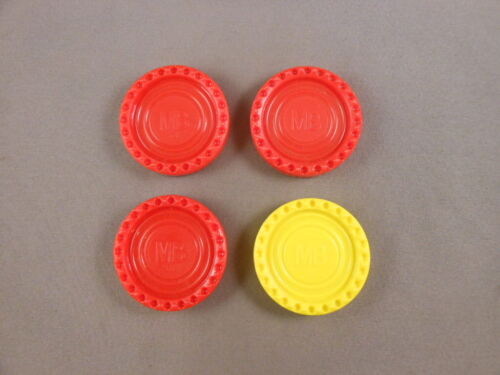
Image resolution: width=500 pixels, height=375 pixels. Find the location of `surface`. surface is located at coordinates [55, 145].